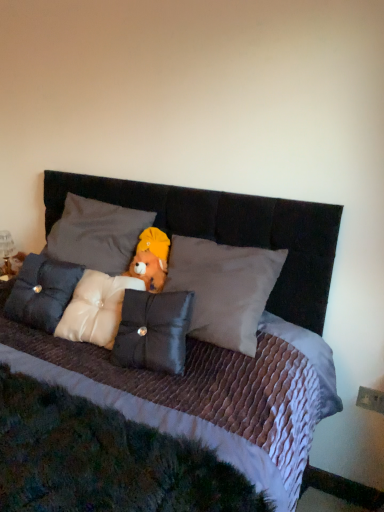
Question: From the image's perspective, is satin cushion at center, which ranks as the 4th pillow in right-to-left order, below white satin pillow at center, placed as the second pillow when sorted from left to right?

Choices:
 (A) no
 (B) yes

Answer: (B)

Question: Is satin cushion at center, marked as the first pillow in a left-to-right arrangement, oriented towards white satin pillow at center, placed as the second pillow when sorted from left to right?

Choices:
 (A) yes
 (B) no

Answer: (B)

Question: Is satin cushion at center, which ranks as the 4th pillow in right-to-left order, in front of white satin pillow at center, placed as the second pillow when sorted from left to right?

Choices:
 (A) yes
 (B) no

Answer: (A)

Question: Can you confirm if satin cushion at center, marked as the first pillow in a left-to-right arrangement, is bigger than white satin pillow at center, the 3th pillow from the right?

Choices:
 (A) no
 (B) yes

Answer: (A)

Question: Considering the relative sizes of satin cushion at center, which ranks as the 4th pillow in right-to-left order, and white satin pillow at center, placed as the second pillow when sorted from left to right, in the image provided, is satin cushion at center, which ranks as the 4th pillow in right-to-left order, wider than white satin pillow at center, placed as the second pillow when sorted from left to right,?

Choices:
 (A) no
 (B) yes

Answer: (A)

Question: Looking at the image, does metallic gold figurine at left seem bigger or smaller compared to satin white pillow at center, which is the second pillow in right-to-left order?

Choices:
 (A) small
 (B) big

Answer: (A)

Question: Is metallic gold figurine at left spatially inside satin white pillow at center, which ranks as the third pillow in left-to-right order, or outside of it?

Choices:
 (A) inside
 (B) outside

Answer: (B)

Question: Is point (19, 258) positioned closer to the camera than point (84, 326)?

Choices:
 (A) farther
 (B) closer

Answer: (A)

Question: From the image's perspective, is metallic gold figurine at left above or below satin white pillow at center, which is the second pillow in right-to-left order?

Choices:
 (A) above
 (B) below

Answer: (A)

Question: Is satin white pillow at center, which is the second pillow in right-to-left order, situated inside satin cushion at center, which ranks as the 4th pillow in right-to-left order, or outside?

Choices:
 (A) outside
 (B) inside

Answer: (A)

Question: In terms of width, does satin white pillow at center, which is the second pillow in right-to-left order, look wider or thinner when compared to satin cushion at center, marked as the first pillow in a left-to-right arrangement?

Choices:
 (A) wide
 (B) thin

Answer: (A)

Question: Relative to satin cushion at center, marked as the first pillow in a left-to-right arrangement, is satin white pillow at center, which ranks as the third pillow in left-to-right order, in front or behind?

Choices:
 (A) behind
 (B) front

Answer: (B)

Question: From a real-world perspective, is satin white pillow at center, which is the second pillow in right-to-left order, above or below satin cushion at center, marked as the first pillow in a left-to-right arrangement?

Choices:
 (A) above
 (B) below

Answer: (B)

Question: In the image, is fuzzy fabric teddy bear at center on the left side or the right side of white satin pillow at center, placed as the second pillow when sorted from left to right?

Choices:
 (A) right
 (B) left

Answer: (A)

Question: From a real-world perspective, is fuzzy fabric teddy bear at center positioned above or below white satin pillow at center, placed as the second pillow when sorted from left to right?

Choices:
 (A) above
 (B) below

Answer: (B)